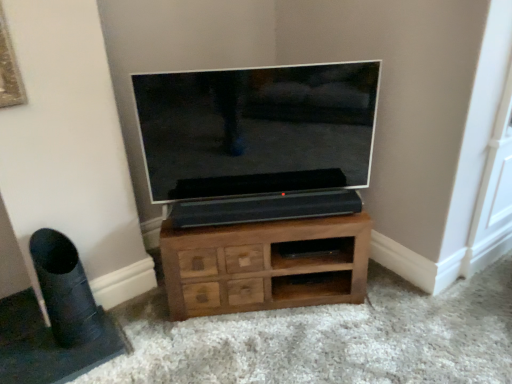
Locate an element on the screen. free space in front of black matte speaker at lower left is located at coordinates (59, 366).